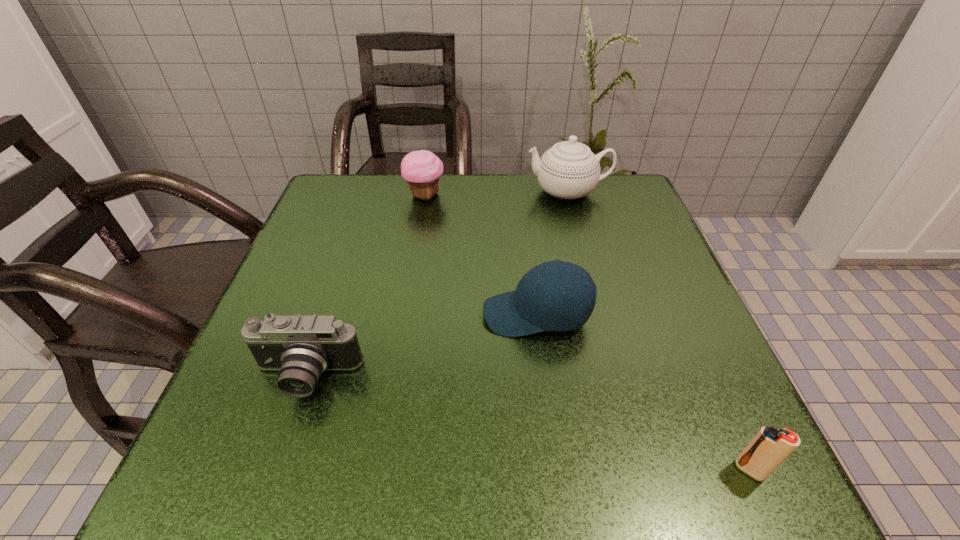
In the image, there is a desktop. Identify the location of free space at the near right corner. This screenshot has width=960, height=540. (665, 444).

Identify the location of free space between the cupcake and the tallest object. (496, 194).

The width and height of the screenshot is (960, 540). I want to click on empty space that is in between the chinaware and the cupcake, so click(496, 194).

You are a GUI agent. You are given a task and a screenshot of the screen. Output one action in this format:
    pyautogui.click(x=<x>, y=<y>)
    Task: Click on the free point between the tallest object and the camera
    The image size is (960, 540).
    Given the screenshot: What is the action you would take?
    pyautogui.click(x=437, y=285)

Locate an element on the screen. vacant space in between the chinaware and the nearest object is located at coordinates [x=659, y=331].

Where is `free space between the third nearest object and the igniter`? free space between the third nearest object and the igniter is located at coordinates (643, 392).

The height and width of the screenshot is (540, 960). Identify the location of empty space between the camera and the baseball cap. (421, 346).

You are a GUI agent. You are given a task and a screenshot of the screen. Output one action in this format:
    pyautogui.click(x=<x>, y=<y>)
    Task: Click on the vacant space in between the baseball cap and the chinaware
    The width and height of the screenshot is (960, 540).
    Given the screenshot: What is the action you would take?
    pyautogui.click(x=552, y=253)

The height and width of the screenshot is (540, 960). I want to click on free spot between the third farthest object and the leftmost object, so click(x=421, y=346).

Where is `vacant area between the camera and the cupcake`? vacant area between the camera and the cupcake is located at coordinates (366, 287).